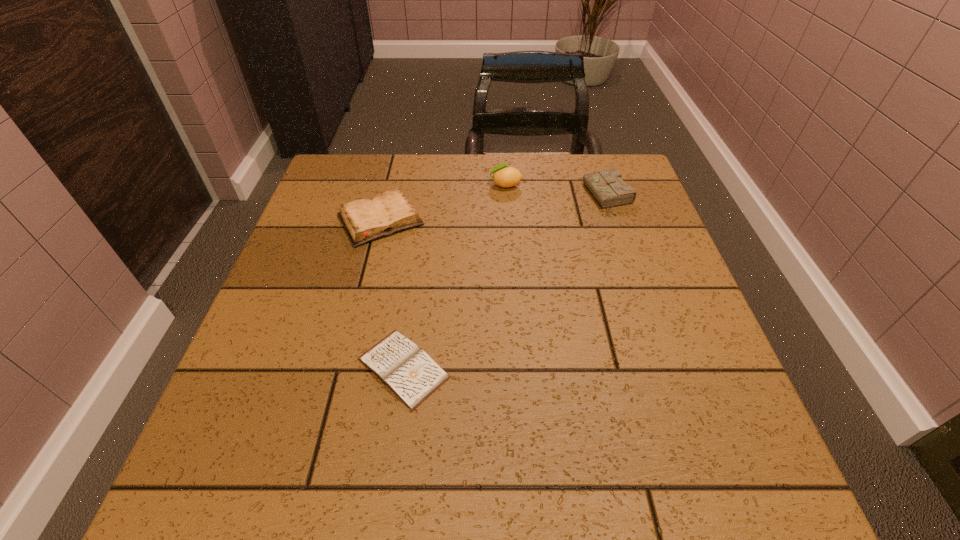
I want to click on free point that satisfies the following two spatial constraints: 1. on the back side of the rightmost object; 2. with leaves positioned above the third object from left to right, so click(604, 185).

This screenshot has width=960, height=540. Find the location of `free space that satisfies the following two spatial constraints: 1. on the back side of the rightmost diary; 2. on the left side of the second shortest diary`. free space that satisfies the following two spatial constraints: 1. on the back side of the rightmost diary; 2. on the left side of the second shortest diary is located at coordinates (386, 197).

Where is `free space that satisfies the following two spatial constraints: 1. with leaves positioned above the third object from left to right; 2. on the back side of the rightmost diary`? free space that satisfies the following two spatial constraints: 1. with leaves positioned above the third object from left to right; 2. on the back side of the rightmost diary is located at coordinates (506, 197).

Find the location of a particular element. The height and width of the screenshot is (540, 960). free region that satisfies the following two spatial constraints: 1. with leaves positioned above the rightmost diary; 2. on the right side of the tallest object is located at coordinates (506, 197).

I want to click on vacant region that satisfies the following two spatial constraints: 1. with leaves positioned above the rightmost diary; 2. on the left side of the third object from left to right, so click(506, 197).